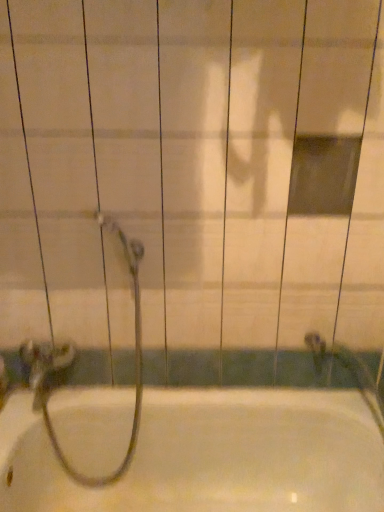
Question: From the image's perspective, is metallic silver garden hose at lower left positioned above or below white glossy bathtub at center?

Choices:
 (A) above
 (B) below

Answer: (A)

Question: Is point (130, 437) positioned closer to the camera than point (195, 415)?

Choices:
 (A) closer
 (B) farther

Answer: (B)

Question: In the image, is metallic silver garden hose at lower left on the left side or the right side of white glossy bathtub at center?

Choices:
 (A) left
 (B) right

Answer: (A)

Question: Looking at their shapes, would you say white glossy bathtub at center is wider or thinner than metallic silver garden hose at lower left?

Choices:
 (A) thin
 (B) wide

Answer: (B)

Question: Choose the correct answer: Is white glossy bathtub at center inside metallic silver garden hose at lower left or outside it?

Choices:
 (A) outside
 (B) inside

Answer: (A)

Question: In terms of size, does white glossy bathtub at center appear bigger or smaller than metallic silver garden hose at lower left?

Choices:
 (A) big
 (B) small

Answer: (A)

Question: Considering their positions, is white glossy bathtub at center located in front of or behind metallic silver garden hose at lower left?

Choices:
 (A) behind
 (B) front

Answer: (B)